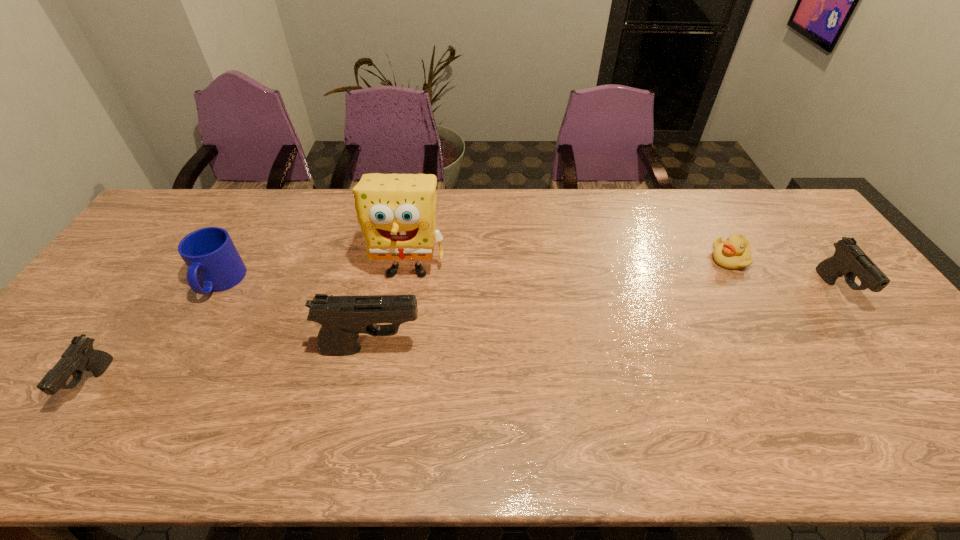
Image resolution: width=960 pixels, height=540 pixels. Identify the location of free spot that satisfies the following two spatial constraints: 1. at the barrel of the rightmost pistol; 2. at the barrel of the second pistol from left to right. (880, 348).

Locate an element on the screen. The height and width of the screenshot is (540, 960). vacant region that satisfies the following two spatial constraints: 1. on the front-facing side of the duckling; 2. on the face of the tallest object is located at coordinates (735, 268).